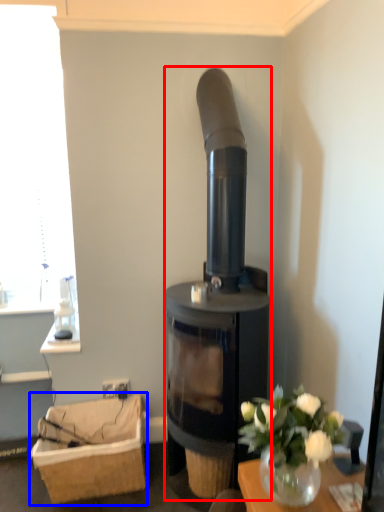
Question: Which of the following is the farthest to the observer, wood burning stove (highlighted by a red box) or basket (highlighted by a blue box)?

Choices:
 (A) wood burning stove
 (B) basket

Answer: (B)